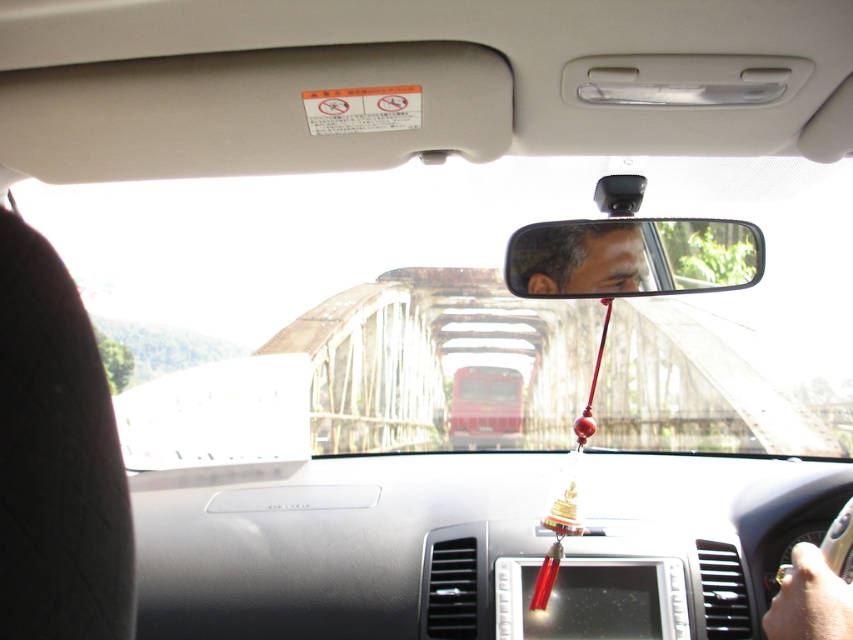
Question: Does black leather seat at left have a greater width compared to matte black mirror at center?

Choices:
 (A) no
 (B) yes

Answer: (A)

Question: Is transparent glass bridge at center wider than matte black mirror at center?

Choices:
 (A) no
 (B) yes

Answer: (A)

Question: Among these points, which one is farthest from the camera?

Choices:
 (A) (628, 257)
 (B) (102, 506)
 (C) (437, 368)

Answer: (C)

Question: Which object appears farthest from the camera in this image?

Choices:
 (A) transparent glass bridge at center
 (B) matte black mirror at center
 (C) black leather seat at left

Answer: (A)

Question: Which point appears closest to the camera in this image?

Choices:
 (A) (679, 186)
 (B) (48, 308)
 (C) (711, 221)

Answer: (B)

Question: Is black leather seat at left to the right of matte black mirror at center from the viewer's perspective?

Choices:
 (A) no
 (B) yes

Answer: (A)